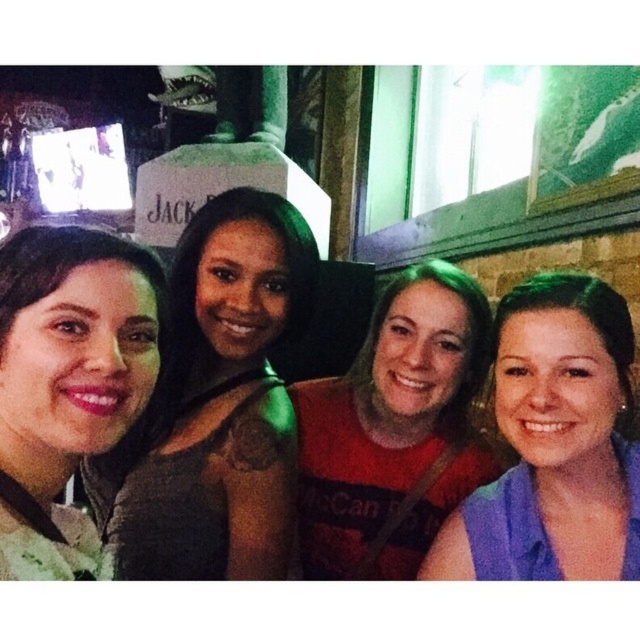
Question: Among these points, which one is nearest to the camera?

Choices:
 (A) (150, 358)
 (B) (243, 493)
 (C) (522, 403)
 (D) (467, 324)

Answer: (A)

Question: Among these points, which one is farthest from the camera?

Choices:
 (A) (563, 512)
 (B) (16, 540)

Answer: (A)

Question: Can you confirm if matte black dress at left is wider than matte gray sweater at left?

Choices:
 (A) yes
 (B) no

Answer: (A)

Question: Which of the following is the farthest from the observer?

Choices:
 (A) blue fabric shirt at right
 (B) matte gray sweater at left
 (C) red matte shirt at center

Answer: (C)

Question: Does matte black dress at left lie behind blue fabric shirt at right?

Choices:
 (A) yes
 (B) no

Answer: (A)

Question: Does matte black dress at left have a lesser width compared to red matte shirt at center?

Choices:
 (A) yes
 (B) no

Answer: (B)